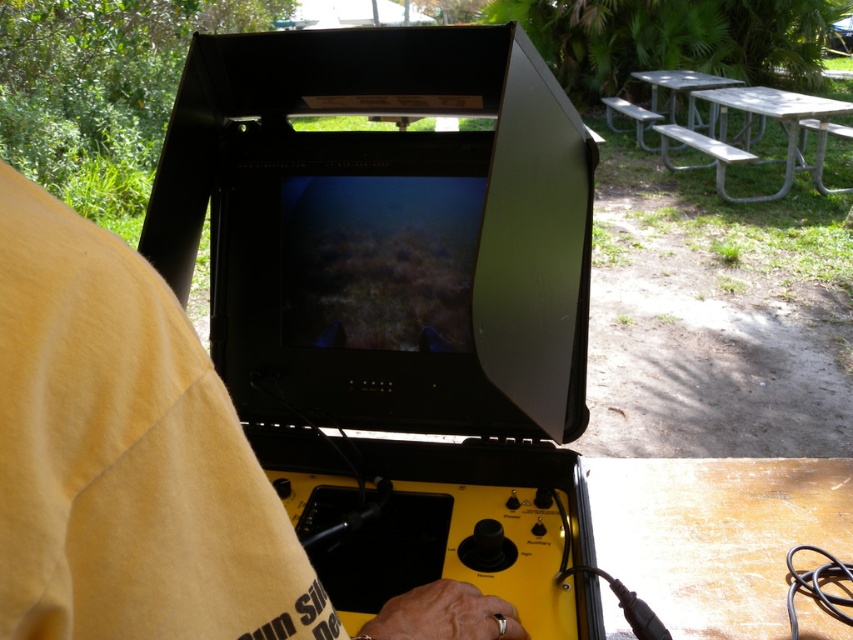
Question: Can you confirm if yellow cotton shirt at center is thinner than wooden picnic table at lower right?

Choices:
 (A) yes
 (B) no

Answer: (A)

Question: Does yellow cotton shirt at center have a greater width compared to wooden picnic table at lower right?

Choices:
 (A) yes
 (B) no

Answer: (B)

Question: Does wooden picnic table at lower right appear over silver metallic picnic table at upper right?

Choices:
 (A) yes
 (B) no

Answer: (B)

Question: Estimate the real-world distances between objects in this image. Which object is closer to the yellow cotton shirt at center?

Choices:
 (A) wooden picnic table at lower right
 (B) silver metallic picnic table at upper right

Answer: (A)

Question: Considering the real-world distances, which object is farthest from the silver metallic picnic table at upper right?

Choices:
 (A) yellow cotton shirt at center
 (B) wooden picnic table at lower right

Answer: (A)

Question: Which point is farther from the camera taking this photo?

Choices:
 (A) (747, 120)
 (B) (78, 269)

Answer: (A)